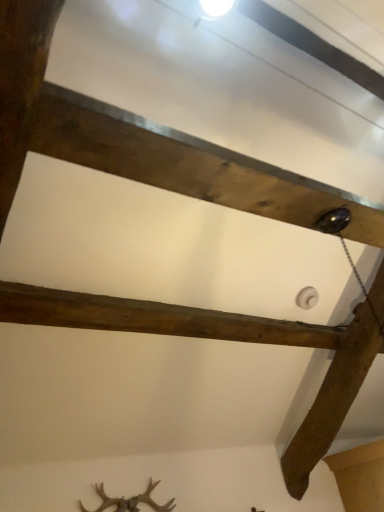
Find the location of `antlered skull at lower center`. antlered skull at lower center is located at coordinates (132, 500).

Describe the element at coordinates (132, 500) in the screenshot. I see `antlered skull at lower center` at that location.

In order to click on antlered skull at lower center in this screenshot , I will do `click(132, 500)`.